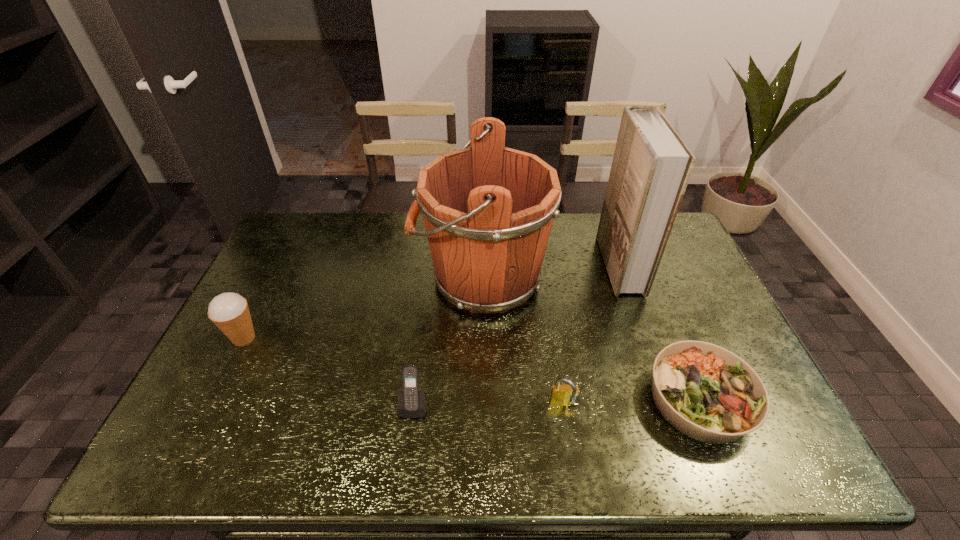
At what (x,y) coordinates should I click in order to perform the action: click on blank space located with the handle on the side of the bucket. Please return your answer as a coordinate pair (x, y). Looking at the image, I should click on (348, 278).

Find the location of `free spot located 0.380m with the handle on the side of the bucket`. free spot located 0.380m with the handle on the side of the bucket is located at coordinates pos(296,278).

The height and width of the screenshot is (540, 960). In order to click on free spot located 0.370m with the handle on the side of the bucket in this screenshot , I will do `click(299, 278)`.

Locate an element on the screen. Image resolution: width=960 pixels, height=540 pixels. vacant space positioned on the front of the icecream is located at coordinates (183, 461).

Locate an element on the screen. Image resolution: width=960 pixels, height=540 pixels. vacant position located 0.050m on the front-facing side of the cellular telephone is located at coordinates (410, 438).

Where is `vacant space situated on the side with the combination dials of the second shortest object`? The width and height of the screenshot is (960, 540). vacant space situated on the side with the combination dials of the second shortest object is located at coordinates (570, 448).

Identify the location of vacant space located 0.130m on the left of the shortest object. (595, 400).

Locate an element on the screen. The image size is (960, 540). phonebook situated at the far edge is located at coordinates (651, 167).

Where is `bucket present at the far edge`? bucket present at the far edge is located at coordinates (488, 210).

Where is `object that is at the near edge`? object that is at the near edge is located at coordinates (706, 392).